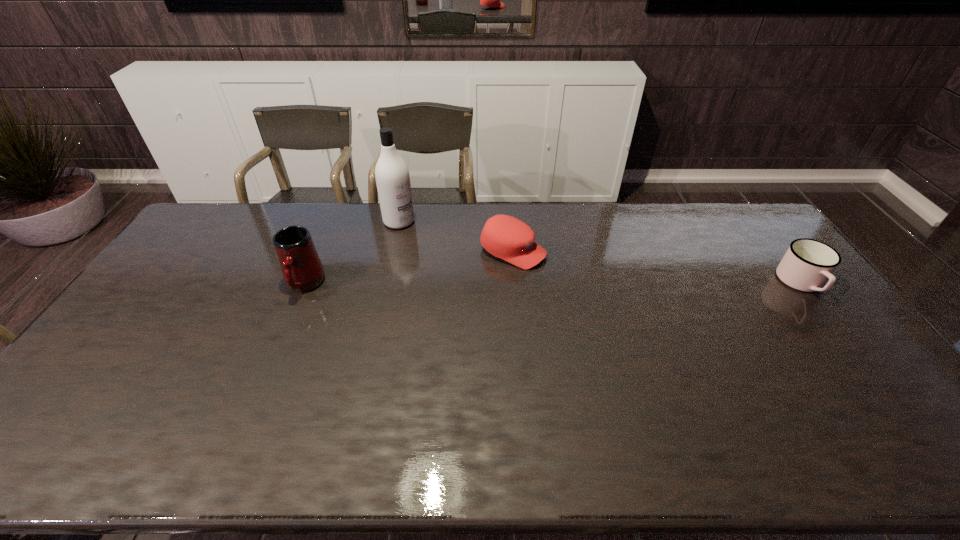
I want to click on free spot on the desktop that is between the taller mug and the rightmost object and is positioned on the front-facing side of the second object from right to left, so click(x=597, y=284).

The width and height of the screenshot is (960, 540). I want to click on vacant spot on the desktop that is between the taller mug and the shorter mug and is positioned on the front-facing side of the second object from left to right, so click(480, 284).